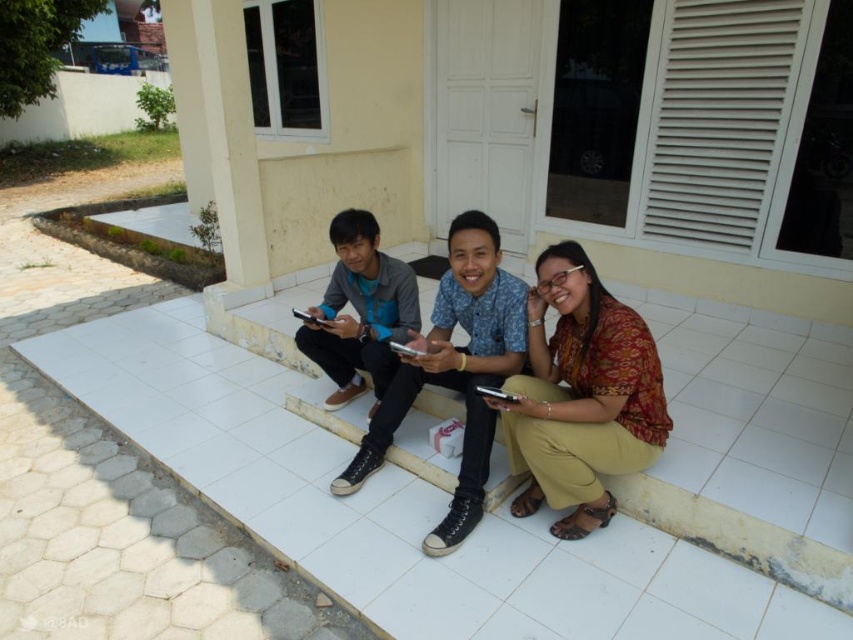
Is printed cotton shirt at center in front of matte gray sneakers at center?

Yes, printed cotton shirt at center is closer to the viewer.

Is printed cotton shirt at center above matte gray sneakers at center?

No.

At what (x,y) coordinates should I click in order to perform the action: click on printed cotton shirt at center. Please return your answer as a coordinate pair (x, y). This screenshot has height=640, width=853. Looking at the image, I should click on (581, 396).

Who is more distant from viewer, (494, 244) or (367, 248)?

Point (367, 248)

Can you confirm if matte black sneakers at center is positioned to the left of matte gray sneakers at center?

In fact, matte black sneakers at center is to the right of matte gray sneakers at center.

Is point (512, 292) less distant than point (360, 211)?

Yes.

Where is `matte black sneakers at center`? This screenshot has width=853, height=640. matte black sneakers at center is located at coordinates (456, 369).

Does printed cotton shirt at center have a larger size compared to matte black sneakers at center?

Actually, printed cotton shirt at center might be smaller than matte black sneakers at center.

What do you see at coordinates (581, 396) in the screenshot? This screenshot has height=640, width=853. I see `printed cotton shirt at center` at bounding box center [581, 396].

Where is `printed cotton shirt at center`? This screenshot has width=853, height=640. printed cotton shirt at center is located at coordinates (581, 396).